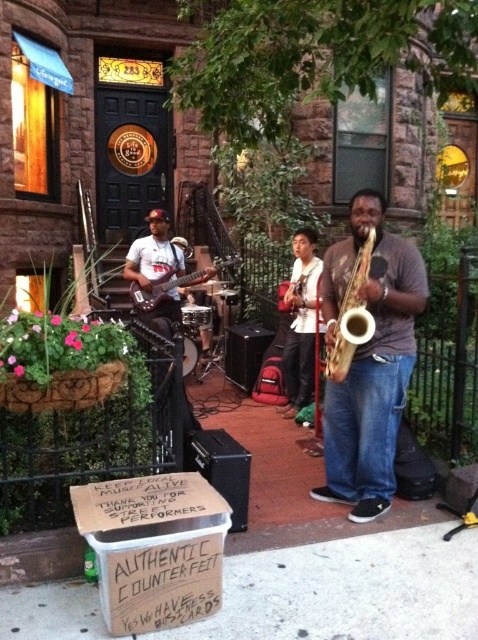
Question: Based on their relative distances, which object is farther from the matte black guitar at center?

Choices:
 (A) white concrete pavement at lower center
 (B) gold metallic saxophone at center
 (C) shiny black electric guitar at center
 (D) shiny gold saxophone at center

Answer: (A)

Question: Is matte black guitar at center positioned behind shiny black electric guitar at center?

Choices:
 (A) yes
 (B) no

Answer: (B)

Question: Can you confirm if white concrete pavement at lower center is positioned above shiny gold saxophone at center?

Choices:
 (A) no
 (B) yes

Answer: (A)

Question: Does white concrete pavement at lower center appear over shiny gold saxophone at center?

Choices:
 (A) yes
 (B) no

Answer: (B)

Question: Which object is positioned closest to the shiny gold saxophone at center?

Choices:
 (A) white concrete pavement at lower center
 (B) gold metallic saxophone at center
 (C) shiny black electric guitar at center

Answer: (B)

Question: Estimate the real-world distances between objects in this image. Which object is farther from the shiny gold saxophone at center?

Choices:
 (A) gold metallic saxophone at center
 (B) shiny black electric guitar at center
 (C) matte black guitar at center
 (D) white concrete pavement at lower center

Answer: (B)